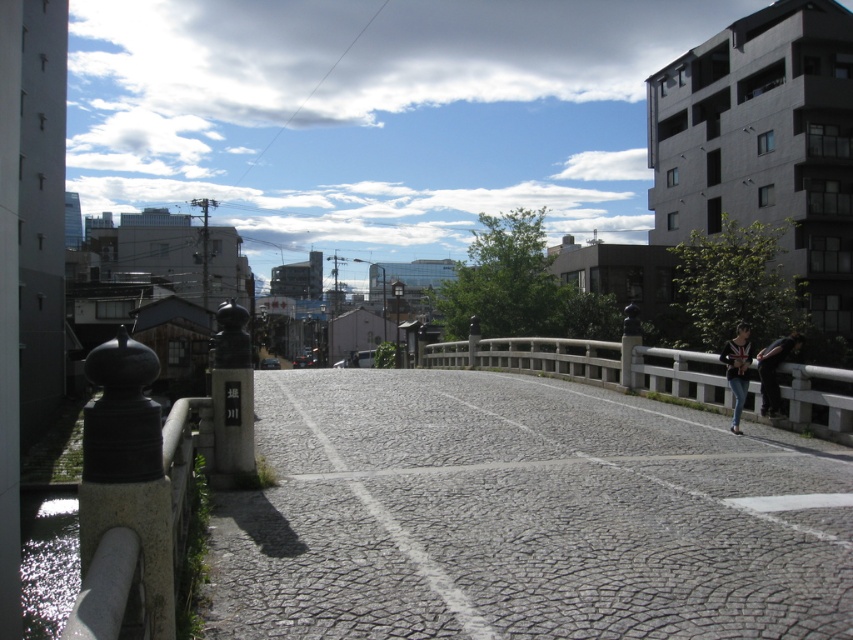
You are a traveler standing on the cobblestone bridge and see the denim jacket at right and the dark gray fabric jacket at center right. Which jacket is higher up in the scene?

The denim jacket at right is taller than the dark gray fabric jacket at center right, so the denim jacket at right is higher up in the scene.